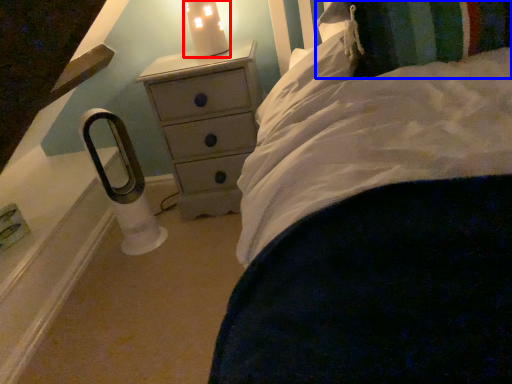
Question: Which object is closer to the camera taking this photo, candle holder (highlighted by a red box) or pillow (highlighted by a blue box)?

Choices:
 (A) candle holder
 (B) pillow

Answer: (B)